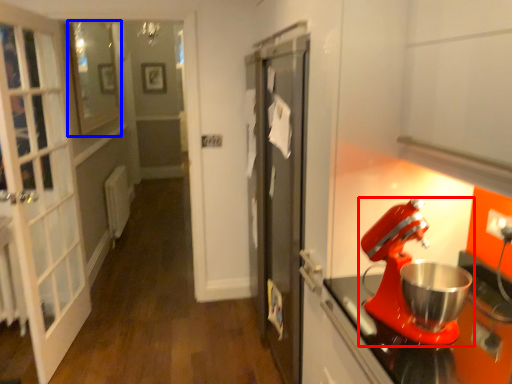
Question: Which object is closer to the camera taking this photo, mixer (highlighted by a red box) or window (highlighted by a blue box)?

Choices:
 (A) mixer
 (B) window

Answer: (A)